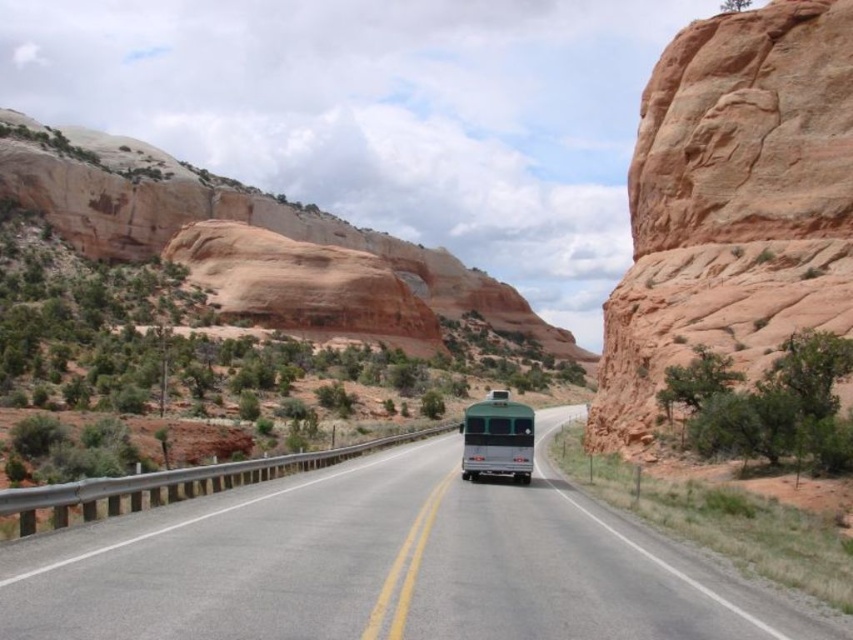
Can you confirm if green metallic bus at center is wider than rustic sandstone cliff at right?

Correct, the width of green metallic bus at center exceeds that of rustic sandstone cliff at right.

Can you confirm if green metallic bus at center is smaller than rustic sandstone cliff at right?

Correct, green metallic bus at center occupies less space than rustic sandstone cliff at right.

Which is in front, point (701, 564) or point (844, 186)?

Positioned in front is point (701, 564).

The image size is (853, 640). In order to click on green metallic bus at center in this screenshot , I will do `click(386, 564)`.

Consider the image. Does rustic sandstone cliff at right have a smaller size compared to rustic sandstone arch at upper center?

Yes, rustic sandstone cliff at right is smaller than rustic sandstone arch at upper center.

Who is more distant from viewer, (628, 404) or (227, 182)?

The point (227, 182) is more distant.

The height and width of the screenshot is (640, 853). I want to click on rustic sandstone cliff at right, so click(732, 204).

Is point (248, 637) positioned behind point (480, 472)?

No, it is not.

Between green metallic bus at center and green matte bus at center, which one has more height?

With more height is green matte bus at center.

Locate an element on the screen. The width and height of the screenshot is (853, 640). green metallic bus at center is located at coordinates (386, 564).